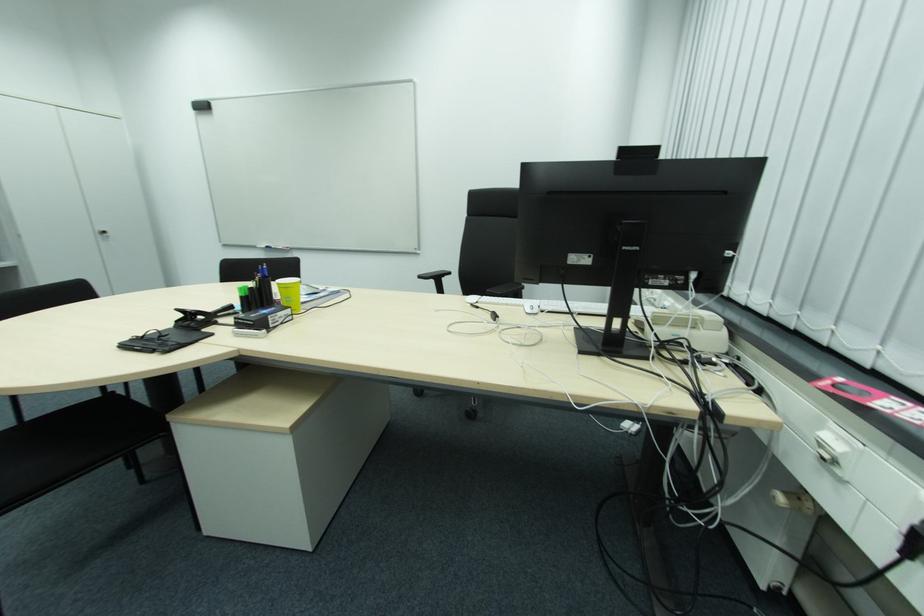
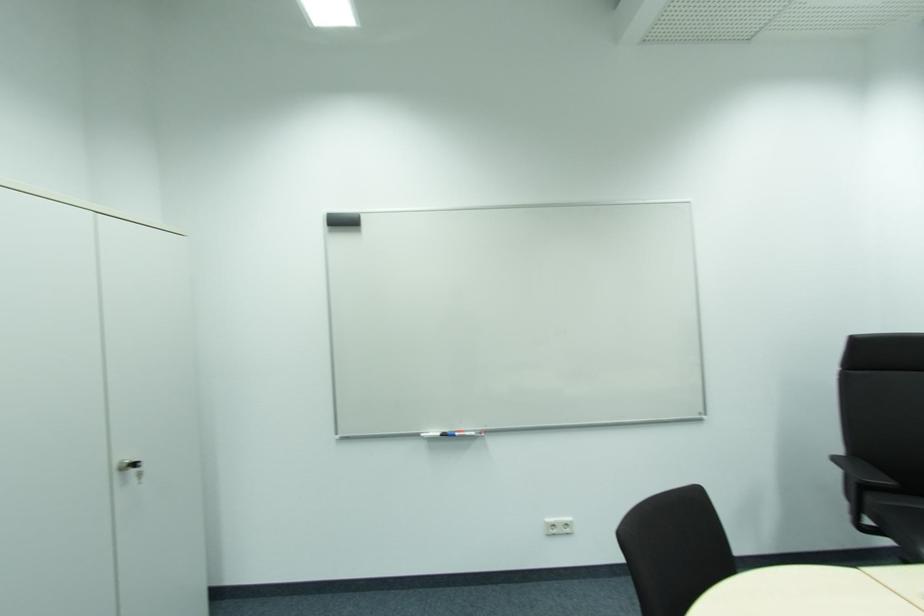
Which direction would the cameraman need to move to produce the second image?

The movement direction of the cameraman is left, forward.